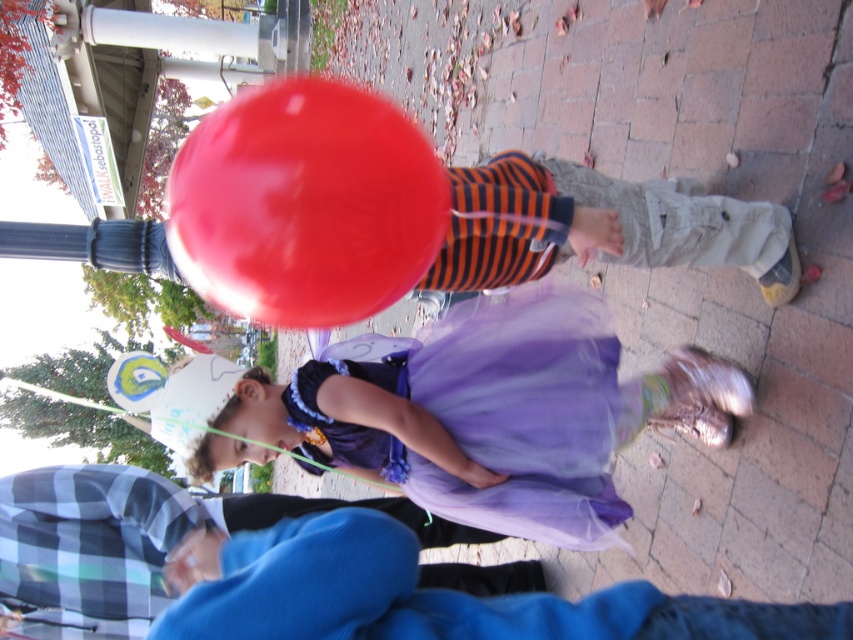
Based on the photo, you are standing in the scene and want to move from point A to point B. Point A is at coordinate point (694, 385) and point B is at coordinate point (457, 268). Since you are facing the scene, which direction should you move to get from point A to point B?

Since point A at coordinate point (694, 385) is closer to you than point B at coordinate point (457, 268), you should move forward to reach point B from point A.

You are standing at the center of the image and want to locate the purple tulle dress at center. According to the coordinates provided, in which direction should you look to find it?

The purple tulle dress at center is located at coordinates point (515, 413), so you should look towards the lower right direction from the center.

Consider the image. You are a photographer trying to position a tripod to capture the purple tulle dress at center in the best possible focus. Given the dress is at coordinates 0.647, 0.605, where should you aim the camera?

The purple tulle dress at center is located at coordinates [515,413], so aim the camera directly at those coordinates to ensure the dress is in focus.